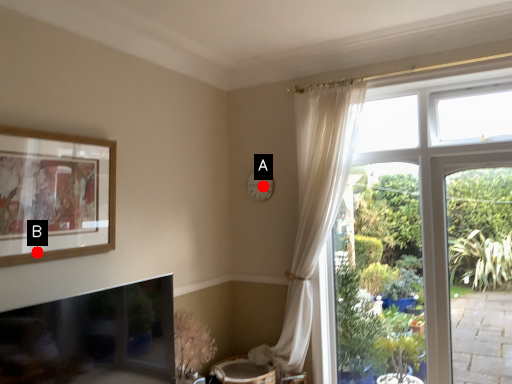
Question: Two points are circled on the image, labeled by A and B beside each circle. Among these points, which one is nearest to the camera?

Choices:
 (A) A is closer
 (B) B is closer

Answer: (B)